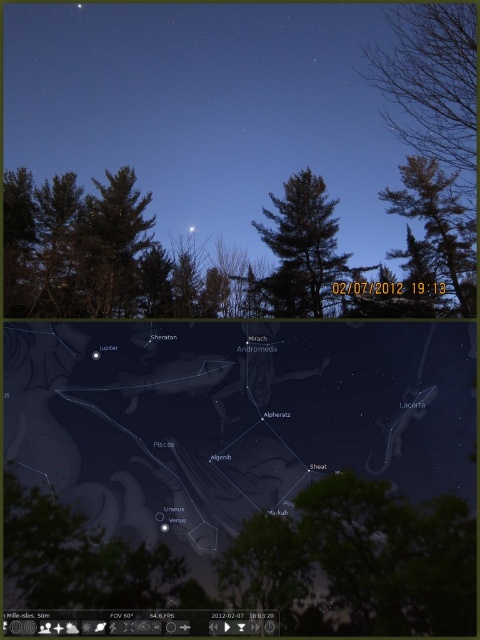
Looking at this image, you are an astronomer analyzing the image. You need to determine if the transparent overlay at center can be fully viewed without obstruction from the brown textured tree at left. Based on the scene description, can you confirm this?

The transparent overlay at center has a lesser height compared to the brown textured tree at left, so it might be partially obscured by the tree. However, since the overlay is at the center and the tree is at the left, its position might allow full visibility depending on their horizontal alignment. The description only mentions height difference, not horizontal overlap.

You are an astronomer analyzing the image. You notice the transparent overlay at center and the brown textured tree at left. Which object is positioned lower in the image?

The transparent overlay at center is located below the brown textured tree at left, so it is positioned lower in the image.

Consider the image. You are an astronomer analyzing the image. You notice the matte black stars at upper center and the bare branches at upper right. Which object occupies a larger area in the image?

The matte black stars at upper center occupy a larger area than the bare branches at upper right because the matte black stars at upper center has a greater width.